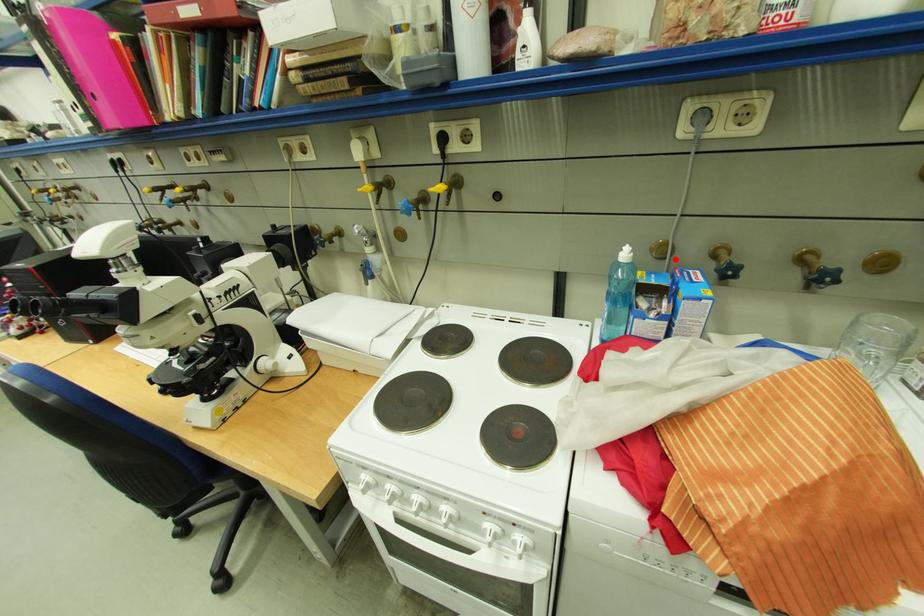
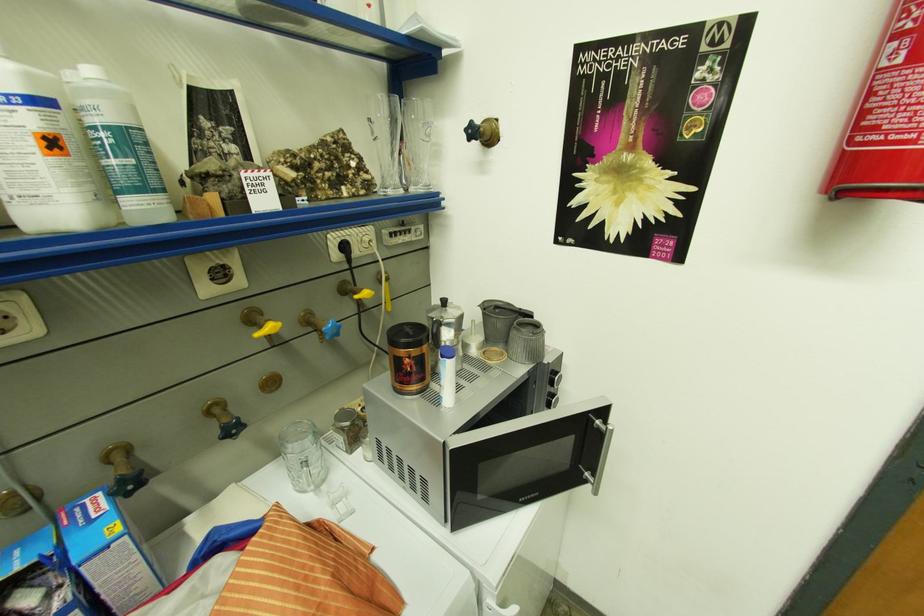
In the second image, find the point that corresponds to the highlighted location in the first image.

(42, 509)